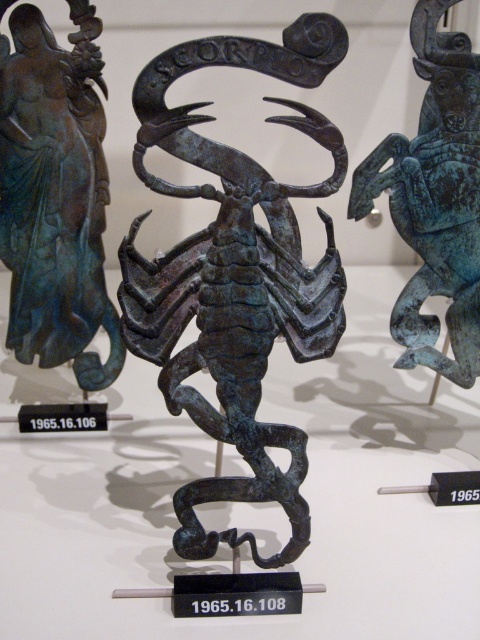
Question: Which object is positioned closest to the bronze statue at left?

Choices:
 (A) bronze scorpion at center
 (B) green patina metal scorpion at center

Answer: (A)

Question: Which object is positioned farthest from the bronze scorpion at center?

Choices:
 (A) green patina metal scorpion at center
 (B) bronze statue at left

Answer: (B)

Question: Among these objects, which one is farthest from the camera?

Choices:
 (A) green patina metal scorpion at center
 (B) bronze statue at left

Answer: (B)

Question: Can you confirm if bronze scorpion at center is positioned below green patina metal scorpion at center?

Choices:
 (A) no
 (B) yes

Answer: (B)

Question: In this image, where is bronze scorpion at center located relative to green patina metal scorpion at center?

Choices:
 (A) left
 (B) right

Answer: (A)

Question: Is bronze scorpion at center further to camera compared to bronze statue at left?

Choices:
 (A) no
 (B) yes

Answer: (A)